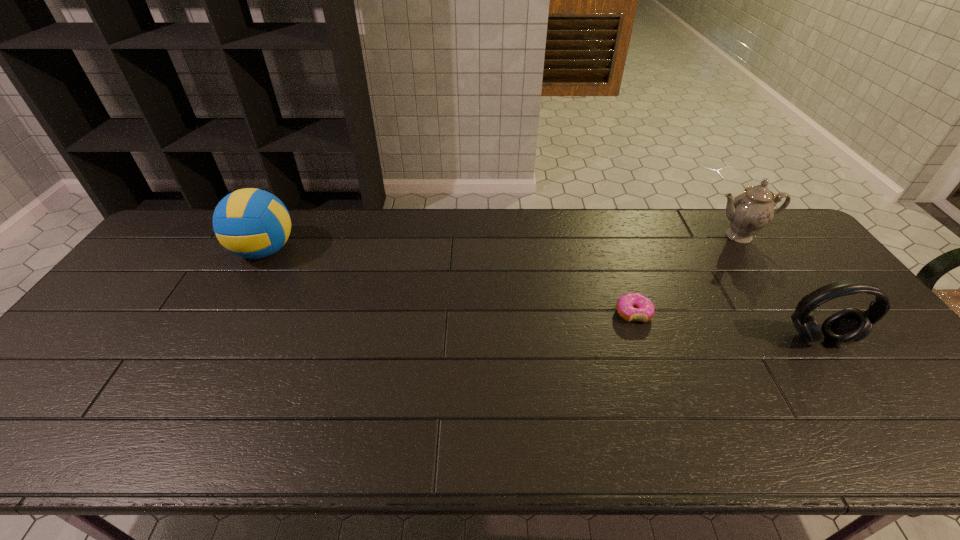
Find the location of a particular element. object that can be found as the closest to the second object from left to right is located at coordinates [850, 325].

You are a GUI agent. You are given a task and a screenshot of the screen. Output one action in this format:
    pyautogui.click(x=<x>, y=<y>)
    Task: Click on the vacant space that satisfies the following two spatial constraints: 1. on the front side of the volleyball; 2. on the left side of the doughnut
    Image resolution: width=960 pixels, height=540 pixels.
    Given the screenshot: What is the action you would take?
    pyautogui.click(x=229, y=313)